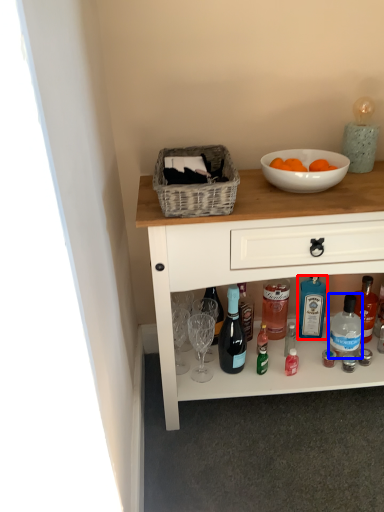
Question: Which point is further to the camera, bottle (highlighted by a red box) or bottle (highlighted by a blue box)?

Choices:
 (A) bottle
 (B) bottle

Answer: (A)